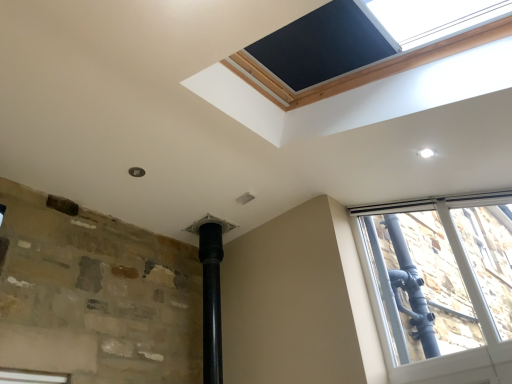
Question: Can you confirm if black matte window screen at upper center is positioned to the right of clear glass window at upper right?

Choices:
 (A) no
 (B) yes

Answer: (A)

Question: Does black matte window screen at upper center have a lesser height compared to clear glass window at upper right?

Choices:
 (A) no
 (B) yes

Answer: (B)

Question: Does black matte window screen at upper center have a greater height compared to clear glass window at upper right?

Choices:
 (A) no
 (B) yes

Answer: (A)

Question: Considering the relative sizes of black matte window screen at upper center and clear glass window at upper right in the image provided, is black matte window screen at upper center bigger than clear glass window at upper right?

Choices:
 (A) no
 (B) yes

Answer: (A)

Question: From the image's perspective, is black matte window screen at upper center on top of clear glass window at upper right?

Choices:
 (A) yes
 (B) no

Answer: (A)

Question: Does black matte window screen at upper center turn towards clear glass window at upper right?

Choices:
 (A) no
 (B) yes

Answer: (A)

Question: Would you consider clear glass window at upper right to be distant from black matte window screen at upper center?

Choices:
 (A) yes
 (B) no

Answer: (A)

Question: From the image's perspective, is clear glass window at upper right beneath black matte window screen at upper center?

Choices:
 (A) no
 (B) yes

Answer: (B)

Question: Does clear glass window at upper right have a lesser height compared to black matte window screen at upper center?

Choices:
 (A) yes
 (B) no

Answer: (B)

Question: Is clear glass window at upper right closer to camera compared to black matte window screen at upper center?

Choices:
 (A) no
 (B) yes

Answer: (A)

Question: Can black matte window screen at upper center be found inside clear glass window at upper right?

Choices:
 (A) no
 (B) yes

Answer: (A)

Question: Is clear glass window at upper right directly adjacent to black matte window screen at upper center?

Choices:
 (A) no
 (B) yes

Answer: (A)

Question: In terms of width, does black matte window screen at upper center look wider or thinner when compared to clear glass window at upper right?

Choices:
 (A) wide
 (B) thin

Answer: (A)